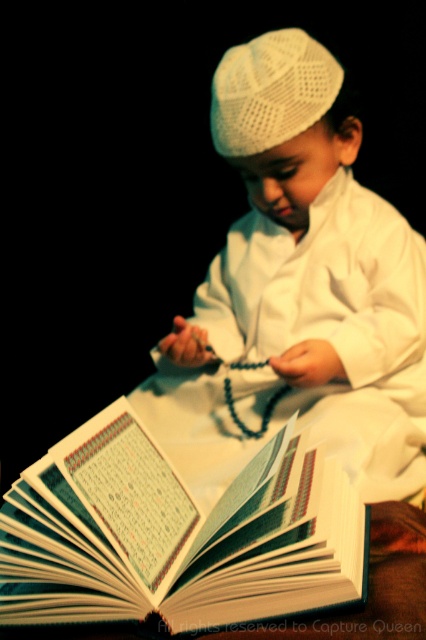
You are taking a photo of a child reading a book. You notice two points in the image at coordinates point (x=371, y=211) and point (x=275, y=140). Which point is closer to the camera?

Point (x=275, y=140) is closer to the camera than point (x=371, y=211).